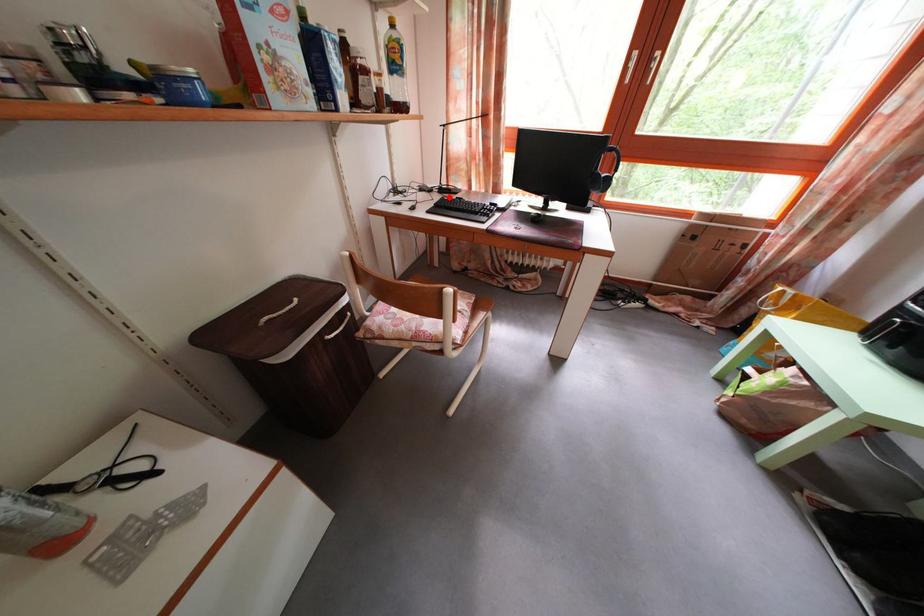
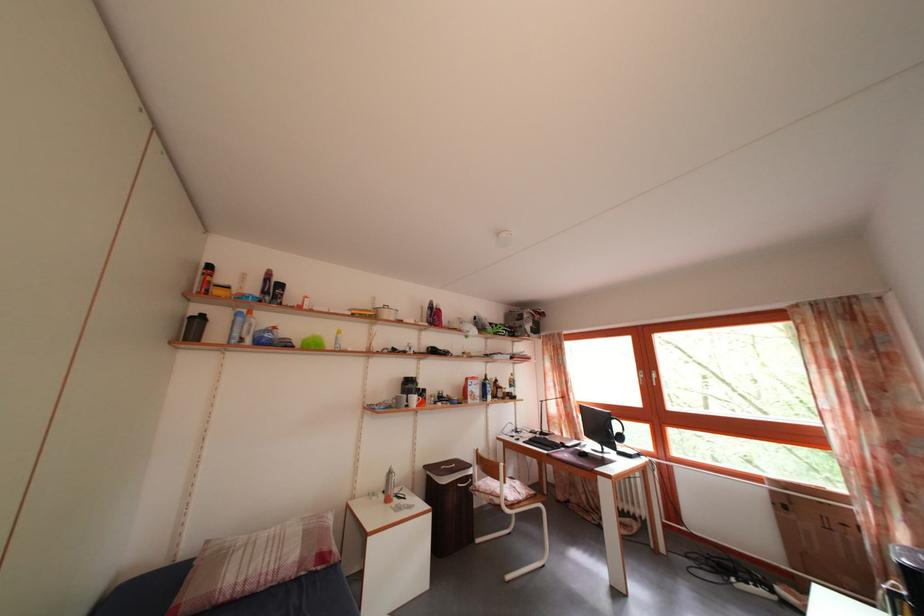
Question: I am providing you with two images of the same scene from different viewpoints. Image1 has a red point marked. In image2, the corresponding 3D location appears at what relative position? Reply with the corresponding letter.

Choices:
 (A) Closer
 (B) Farther

Answer: (B)